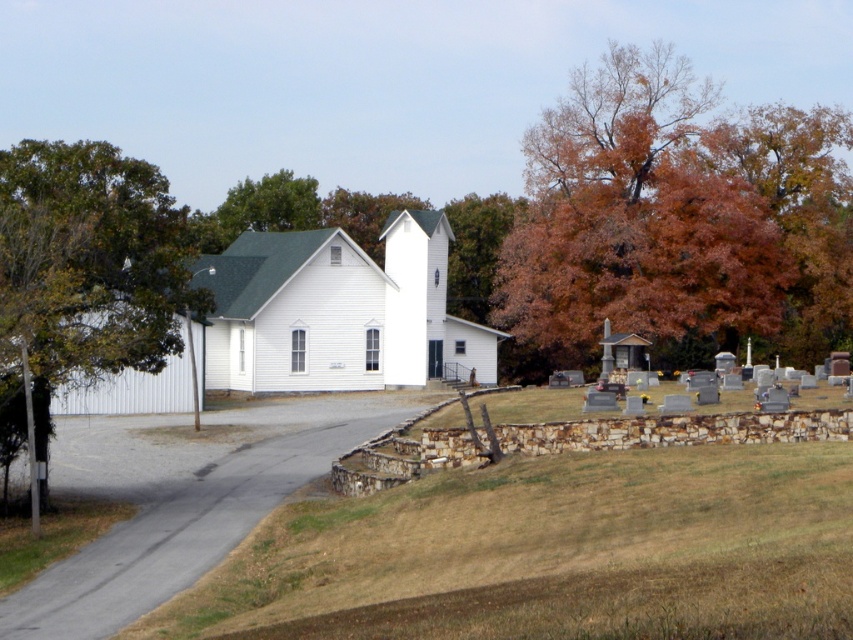
Question: Can you confirm if white wood church at center is positioned above green leafy tree at left?

Choices:
 (A) yes
 (B) no

Answer: (B)

Question: Which of these objects is positioned farthest from the autumn leaves at right?

Choices:
 (A) white wood church at center
 (B) green leafy tree at upper left

Answer: (B)

Question: Which of the following is the closest to the observer?

Choices:
 (A) autumn leaves at right
 (B) green leafy tree at upper left
 (C) white wood church at center
 (D) green leafy tree at left

Answer: (D)

Question: Which point is closer to the camera?

Choices:
 (A) (312, 234)
 (B) (283, 220)
 (C) (836, 323)
 (D) (78, 333)

Answer: (D)

Question: Is autumn leaves at right bigger than green leafy tree at upper left?

Choices:
 (A) no
 (B) yes

Answer: (B)

Question: Is autumn leaves at right thinner than green leafy tree at left?

Choices:
 (A) yes
 (B) no

Answer: (B)